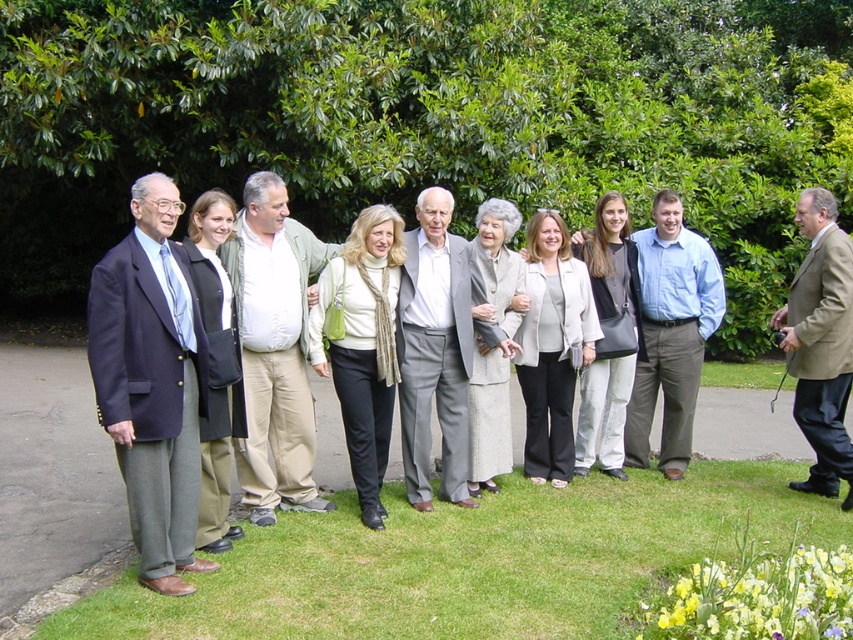
Can you confirm if green grass at lower center is shorter than matte white scarf at center?

Correct, green grass at lower center is not as tall as matte white scarf at center.

Is green grass at lower center below matte white scarf at center?

Yes, green grass at lower center is below matte white scarf at center.

Is point (566, 552) farther from viewer compared to point (357, 403)?

No, it is not.

Locate an element on the screen. This screenshot has width=853, height=640. green grass at lower center is located at coordinates (473, 561).

Which of these two, matte black suit at left or light beige jacket at center, stands taller?

Result: With more height is matte black suit at left.

Between matte black suit at left and light beige jacket at center, which one appears on the right side from the viewer's perspective?

Positioned to the right is light beige jacket at center.

Identify the location of matte black suit at left. Image resolution: width=853 pixels, height=640 pixels. click(152, 381).

In the scene shown: Is matte white scarf at center below beige wool suit at center?

Indeed, matte white scarf at center is positioned under beige wool suit at center.

Is matte white scarf at center further to camera compared to beige wool suit at center?

No, it is not.

Describe the element at coordinates (363, 346) in the screenshot. The image size is (853, 640). I see `matte white scarf at center` at that location.

At what (x,y) coordinates should I click in order to perform the action: click on matte white scarf at center. Please return your answer as a coordinate pair (x, y). Looking at the image, I should click on (363, 346).